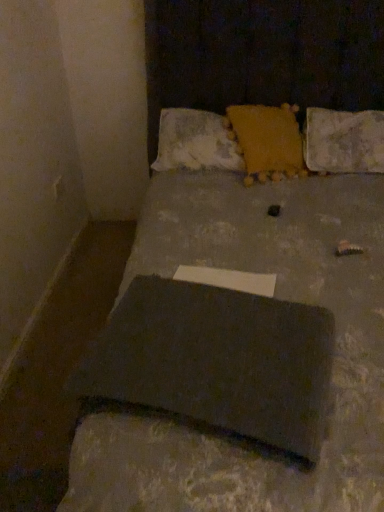
What is the approximate width of slate at center?

slate at center is 15.73 inches wide.

Image resolution: width=384 pixels, height=512 pixels. What do you see at coordinates (215, 364) in the screenshot?
I see `slate at center` at bounding box center [215, 364].

How much space does textured yellow pillow at center, marked as the 3th pillow in a right-to-left arrangement, occupy horizontally?

The width of textured yellow pillow at center, marked as the 3th pillow in a right-to-left arrangement, is 15.41 inches.

Image resolution: width=384 pixels, height=512 pixels. What do you see at coordinates (195, 142) in the screenshot?
I see `textured yellow pillow at center, which is counted as the first pillow, starting from the left` at bounding box center [195, 142].

The height and width of the screenshot is (512, 384). What are the coordinates of `textured yellow pillow at upper right, which is counted as the first pillow, starting from the right` in the screenshot? It's located at (343, 141).

Measure the distance between matte gray laptop at center and camera.

They are 28.37 inches apart.

The image size is (384, 512). Find the location of `matte gray laptop at center`. matte gray laptop at center is located at coordinates (260, 294).

Where is `slate at center`? This screenshot has height=512, width=384. slate at center is located at coordinates (215, 364).

How many degrees apart are the facing directions of matte gray laptop at center and slate at center?

17.1 degrees.

Is matte gray laptop at center shorter than slate at center?

No, matte gray laptop at center is not shorter than slate at center.

Which object is wider, matte gray laptop at center or slate at center?

matte gray laptop at center.

Is point (314, 156) positioned after point (302, 175)?

Yes, it is behind point (302, 175).

Is the position of textured yellow pillow at upper right, marked as the 3th pillow in a left-to-right arrangement, less distant than that of yellow fuzzy pillow at upper center, placed as the second pillow when sorted from left to right?

No, textured yellow pillow at upper right, marked as the 3th pillow in a left-to-right arrangement, is further to the viewer.

Is textured yellow pillow at upper right, which is counted as the first pillow, starting from the right, inside or outside of yellow fuzzy pillow at upper center, the second pillow viewed from the right?

textured yellow pillow at upper right, which is counted as the first pillow, starting from the right, is not inside yellow fuzzy pillow at upper center, the second pillow viewed from the right, it's outside.

Which of these two, yellow fuzzy pillow at upper center, the second pillow viewed from the right, or textured yellow pillow at upper right, marked as the 3th pillow in a left-to-right arrangement, is wider?

textured yellow pillow at upper right, marked as the 3th pillow in a left-to-right arrangement, is wider.

Is point (271, 159) less distant than point (372, 114)?

Yes, it is.

Is yellow fuzzy pillow at upper center, the second pillow viewed from the right, inside or outside of textured yellow pillow at upper right, which is counted as the first pillow, starting from the right?

yellow fuzzy pillow at upper center, the second pillow viewed from the right, is not enclosed by textured yellow pillow at upper right, which is counted as the first pillow, starting from the right.

From a real-world perspective, is matte gray laptop at center below textured yellow pillow at center, which is counted as the first pillow, starting from the left?

Yes, from a real-world perspective, matte gray laptop at center is under textured yellow pillow at center, which is counted as the first pillow, starting from the left.

Between matte gray laptop at center and textured yellow pillow at center, which is counted as the first pillow, starting from the left, which one has larger width?

Wider between the two is matte gray laptop at center.

Where is `the 2nd pillow to the left when counting from the matte gray laptop at center`? The width and height of the screenshot is (384, 512). the 2nd pillow to the left when counting from the matte gray laptop at center is located at coordinates (195, 142).

Which is correct: matte gray laptop at center is inside textured yellow pillow at center, which is counted as the first pillow, starting from the left, or outside of it?

matte gray laptop at center is located beyond the bounds of textured yellow pillow at center, which is counted as the first pillow, starting from the left.

Does slate at center have a lesser height compared to yellow fuzzy pillow at upper center, placed as the second pillow when sorted from left to right?

Indeed, slate at center has a lesser height compared to yellow fuzzy pillow at upper center, placed as the second pillow when sorted from left to right.

Relative to yellow fuzzy pillow at upper center, the second pillow viewed from the right, is slate at center in front or behind?

In the image, slate at center appears in front of yellow fuzzy pillow at upper center, the second pillow viewed from the right.

From the image's perspective, would you say slate at center is shown under yellow fuzzy pillow at upper center, the second pillow viewed from the right?

Indeed, from the image's perspective, slate at center is shown beneath yellow fuzzy pillow at upper center, the second pillow viewed from the right.

From a real-world perspective, between slate at center and yellow fuzzy pillow at upper center, the second pillow viewed from the right, who is vertically lower?

slate at center, from a real-world perspective.

How distant is textured yellow pillow at upper right, marked as the 3th pillow in a left-to-right arrangement, from matte gray laptop at center?

textured yellow pillow at upper right, marked as the 3th pillow in a left-to-right arrangement, is 67.54 centimeters from matte gray laptop at center.

Is textured yellow pillow at upper right, marked as the 3th pillow in a left-to-right arrangement, at the left side of matte gray laptop at center?

Incorrect, textured yellow pillow at upper right, marked as the 3th pillow in a left-to-right arrangement, is not on the left side of matte gray laptop at center.

From a real-world perspective, which is physically above, textured yellow pillow at upper right, marked as the 3th pillow in a left-to-right arrangement, or matte gray laptop at center?

textured yellow pillow at upper right, marked as the 3th pillow in a left-to-right arrangement.

Is textured yellow pillow at upper right, marked as the 3th pillow in a left-to-right arrangement, taller than matte gray laptop at center?

No, textured yellow pillow at upper right, marked as the 3th pillow in a left-to-right arrangement, is not taller than matte gray laptop at center.

From the image's perspective, is yellow fuzzy pillow at upper center, the second pillow viewed from the right, over matte gray laptop at center?

Result: Correct, yellow fuzzy pillow at upper center, the second pillow viewed from the right, appears higher than matte gray laptop at center in the image.

Is yellow fuzzy pillow at upper center, the second pillow viewed from the right, facing away from matte gray laptop at center?

Correct, yellow fuzzy pillow at upper center, the second pillow viewed from the right, is looking away from matte gray laptop at center.

How distant is yellow fuzzy pillow at upper center, the second pillow viewed from the right, from matte gray laptop at center?

yellow fuzzy pillow at upper center, the second pillow viewed from the right, and matte gray laptop at center are 24.09 inches apart.

Does yellow fuzzy pillow at upper center, placed as the second pillow when sorted from left to right, have a smaller size compared to matte gray laptop at center?

Correct, yellow fuzzy pillow at upper center, placed as the second pillow when sorted from left to right, occupies less space than matte gray laptop at center.

In the image, there is a matte gray laptop at center. Where is `slate below it (from a real-world perspective)`? The width and height of the screenshot is (384, 512). slate below it (from a real-world perspective) is located at coordinates 215,364.

You are a GUI agent. You are given a task and a screenshot of the screen. Output one action in this format:
    pyautogui.click(x=<x>, y=<y>)
    Task: Click on the 1st pillow behind the yellow fuzzy pillow at upper center, the second pillow viewed from the right, counting from the anchor's position
    
    Given the screenshot: What is the action you would take?
    pyautogui.click(x=343, y=141)

Considering their positions, is slate at center positioned further to matte gray laptop at center than yellow fuzzy pillow at upper center, the second pillow viewed from the right?

Among the two, yellow fuzzy pillow at upper center, the second pillow viewed from the right, is located further to matte gray laptop at center.

Estimate the real-world distances between objects in this image. Which object is closer to matte gray laptop at center, yellow fuzzy pillow at upper center, the second pillow viewed from the right, or textured yellow pillow at upper right, which is counted as the first pillow, starting from the right?

yellow fuzzy pillow at upper center, the second pillow viewed from the right.

When comparing their distances from slate at center, does matte gray laptop at center or yellow fuzzy pillow at upper center, the second pillow viewed from the right, seem further?

yellow fuzzy pillow at upper center, the second pillow viewed from the right.

Which object lies nearer to the anchor point yellow fuzzy pillow at upper center, the second pillow viewed from the right, slate at center or textured yellow pillow at upper right, marked as the 3th pillow in a left-to-right arrangement?

Among the two, textured yellow pillow at upper right, marked as the 3th pillow in a left-to-right arrangement, is located nearer to yellow fuzzy pillow at upper center, the second pillow viewed from the right.

Looking at the image, which one is located further to textured yellow pillow at upper right, marked as the 3th pillow in a left-to-right arrangement, matte gray laptop at center or yellow fuzzy pillow at upper center, the second pillow viewed from the right?

matte gray laptop at center lies further to textured yellow pillow at upper right, marked as the 3th pillow in a left-to-right arrangement, than the other object.

Estimate the real-world distances between objects in this image. Which object is further from textured yellow pillow at upper right, marked as the 3th pillow in a left-to-right arrangement, yellow fuzzy pillow at upper center, the second pillow viewed from the right, or textured yellow pillow at center, which is counted as the first pillow, starting from the left?

Based on the image, textured yellow pillow at center, which is counted as the first pillow, starting from the left, appears to be further to textured yellow pillow at upper right, marked as the 3th pillow in a left-to-right arrangement.

Estimate the real-world distances between objects in this image. Which object is further from textured yellow pillow at center, which is counted as the first pillow, starting from the left, matte gray laptop at center or slate at center?

slate at center is further to textured yellow pillow at center, which is counted as the first pillow, starting from the left.

When comparing their distances from textured yellow pillow at upper right, marked as the 3th pillow in a left-to-right arrangement, does slate at center or matte gray laptop at center seem further?

slate at center is positioned further to the anchor textured yellow pillow at upper right, marked as the 3th pillow in a left-to-right arrangement.

Where is `slate between matte gray laptop at center and textured yellow pillow at upper right, marked as the 3th pillow in a left-to-right arrangement, from front to back`? slate between matte gray laptop at center and textured yellow pillow at upper right, marked as the 3th pillow in a left-to-right arrangement, from front to back is located at coordinates (215, 364).

You are a GUI agent. You are given a task and a screenshot of the screen. Output one action in this format:
    pyautogui.click(x=<x>, y=<y>)
    Task: Click on the pillow between textured yellow pillow at center, which is counted as the first pillow, starting from the left, and textured yellow pillow at upper right, which is counted as the first pillow, starting from the right
    The height and width of the screenshot is (512, 384).
    Given the screenshot: What is the action you would take?
    pyautogui.click(x=268, y=141)

Find the location of a particular element. Image resolution: width=384 pixels, height=512 pixels. pillow between slate at center and textured yellow pillow at upper right, which is counted as the first pillow, starting from the right, from front to back is located at coordinates (268, 141).

Where is `slate between matte gray laptop at center and textured yellow pillow at center, which is counted as the first pillow, starting from the left, in the front-back direction`? slate between matte gray laptop at center and textured yellow pillow at center, which is counted as the first pillow, starting from the left, in the front-back direction is located at coordinates (215, 364).